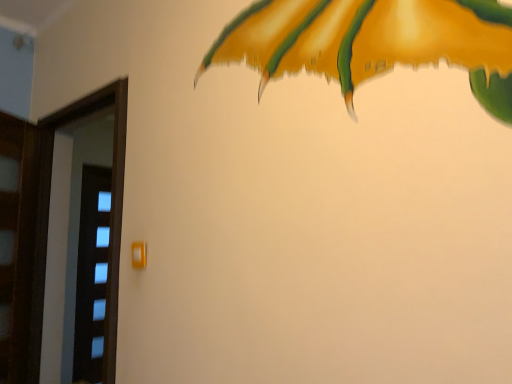
Question: Which is correct: transparent glass screen door at left is inside matte orange door handle at center, or outside of it?

Choices:
 (A) inside
 (B) outside

Answer: (B)

Question: Is transparent glass screen door at left bigger or smaller than matte orange door handle at center?

Choices:
 (A) big
 (B) small

Answer: (A)

Question: From a real-world perspective, is transparent glass screen door at left positioned above or below matte orange door handle at center?

Choices:
 (A) above
 (B) below

Answer: (B)

Question: Which is correct: matte orange door handle at center is inside transparent glass screen door at left, or outside of it?

Choices:
 (A) outside
 (B) inside

Answer: (A)

Question: From a real-world perspective, relative to transparent glass screen door at left, is matte orange door handle at center vertically above or below?

Choices:
 (A) above
 (B) below

Answer: (A)

Question: From the image's perspective, is matte orange door handle at center located above or below transparent glass screen door at left?

Choices:
 (A) above
 (B) below

Answer: (A)

Question: Considering the positions of matte orange door handle at center and transparent glass screen door at left in the image, is matte orange door handle at center taller or shorter than transparent glass screen door at left?

Choices:
 (A) short
 (B) tall

Answer: (A)